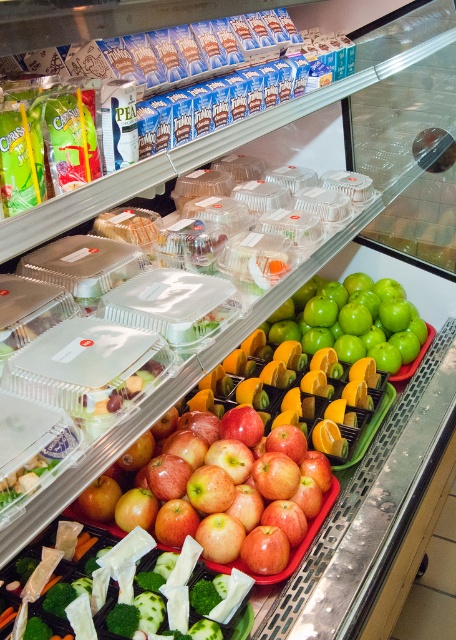
Is green matte apples at center smaller than green leafy vegetables at center?

Incorrect, green matte apples at center is not smaller in size than green leafy vegetables at center.

Identify the location of green matte apples at center. This screenshot has width=456, height=640. (352, 321).

Between point (222, 540) and point (361, 308), which one is positioned in front?

Point (222, 540) is more forward.

Is red matte apples at center to the right of green matte apples at center from the viewer's perspective?

No, red matte apples at center is not to the right of green matte apples at center.

Between point (146, 508) and point (290, 330), which one is positioned behind?

The point (290, 330) is behind.

Image resolution: width=456 pixels, height=640 pixels. I want to click on red matte apples at center, so click(232, 492).

How far apart are red matte apples at center and green leafy vegetables at center?

They are 7.23 inches apart.

The image size is (456, 640). Describe the element at coordinates (232, 492) in the screenshot. I see `red matte apples at center` at that location.

You are a GUI agent. You are given a task and a screenshot of the screen. Output one action in this format:
    pyautogui.click(x=<x>, y=<y>)
    Task: Click on the red matte apples at center
    This screenshot has width=456, height=640.
    Given the screenshot: What is the action you would take?
    pyautogui.click(x=232, y=492)